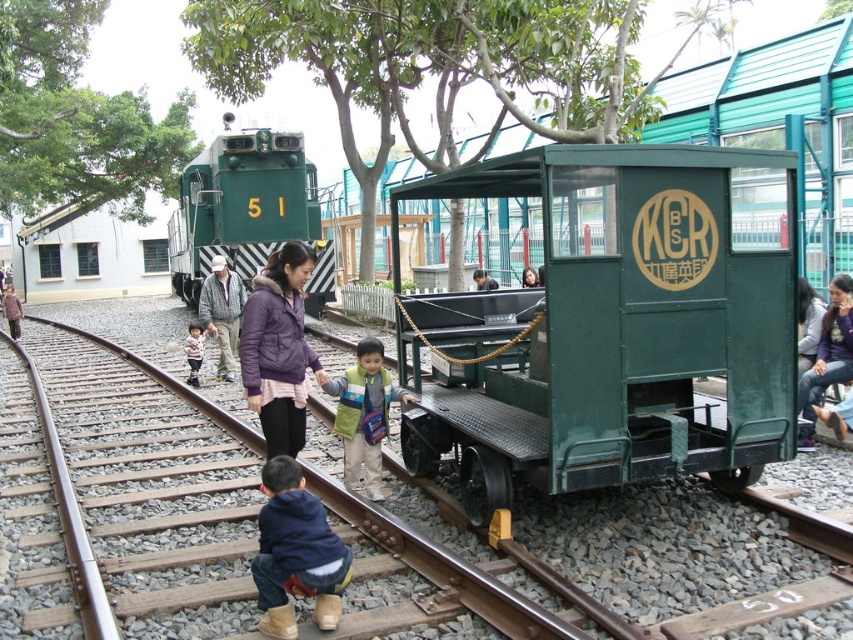
Question: Which object appears closest to the camera in this image?

Choices:
 (A) light blue fabric backpack at center
 (B) dark blue jacket at center

Answer: (A)

Question: Is purple puffy jacket at center bigger than light brown fabric jacket at center?

Choices:
 (A) yes
 (B) no

Answer: (B)

Question: From the image, what is the correct spatial relationship of purple puffy jacket at center in relation to dark purple sweater at right?

Choices:
 (A) below
 (B) above

Answer: (B)

Question: Which object appears farthest from the camera in this image?

Choices:
 (A) dark blue jacket at center
 (B) blue fleece jacket at lower center
 (C) green matte train car at center

Answer: (A)

Question: In this image, where is green metal train track at center located relative to dark blue jacket at center?

Choices:
 (A) left
 (B) right

Answer: (A)

Question: Which of these objects is positioned closest to the khaki fabric hat at center?

Choices:
 (A) dark purple sweater at right
 (B) light brown fabric jacket at center

Answer: (B)